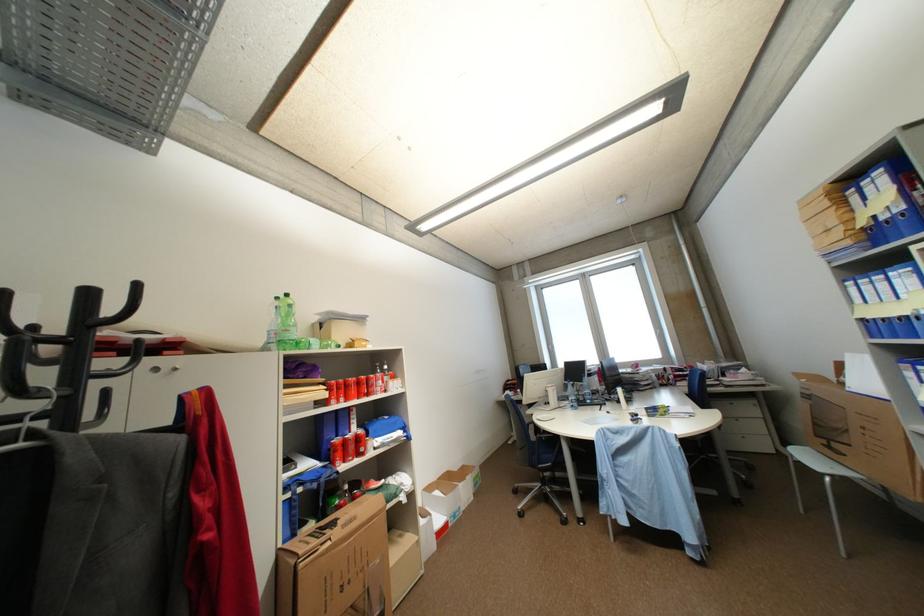
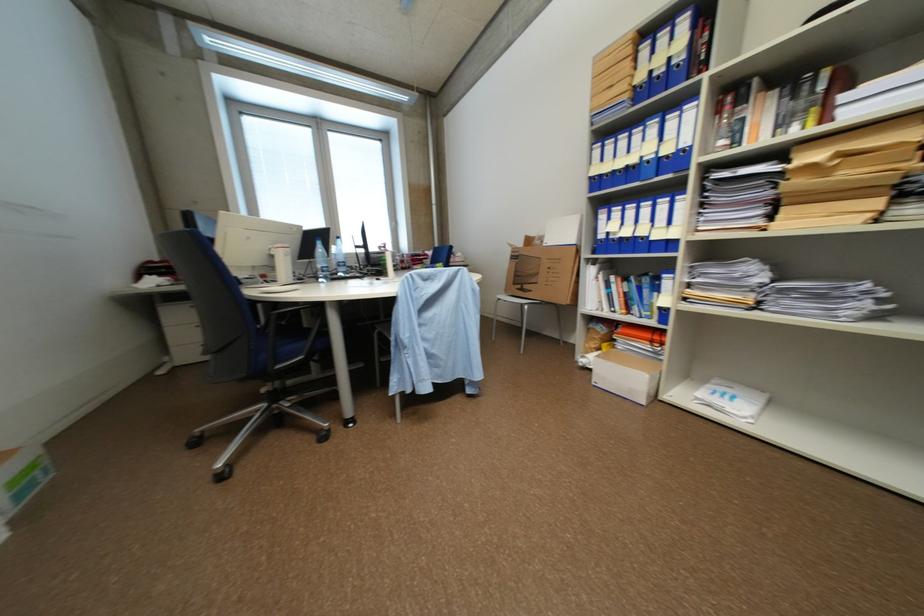
Find the pixel in the second image that matches (870,321) in the first image.

(600, 180)